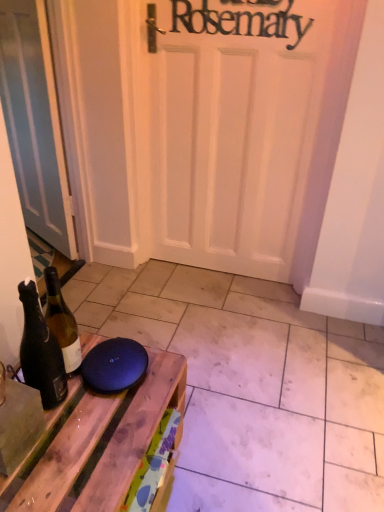
Where is `free space in front of dark brown glass bottle at left`? Image resolution: width=384 pixels, height=512 pixels. free space in front of dark brown glass bottle at left is located at coordinates (57, 463).